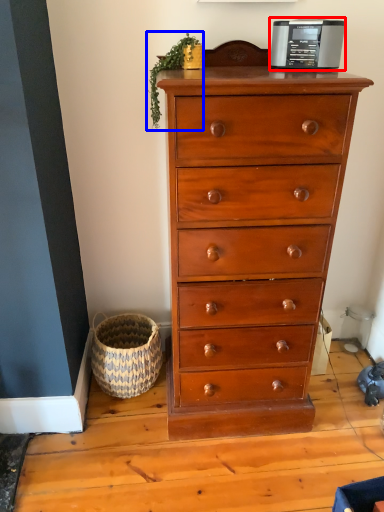
Question: Which object is further to the camera taking this photo, appliance (highlighted by a red box) or plant (highlighted by a blue box)?

Choices:
 (A) appliance
 (B) plant

Answer: (B)